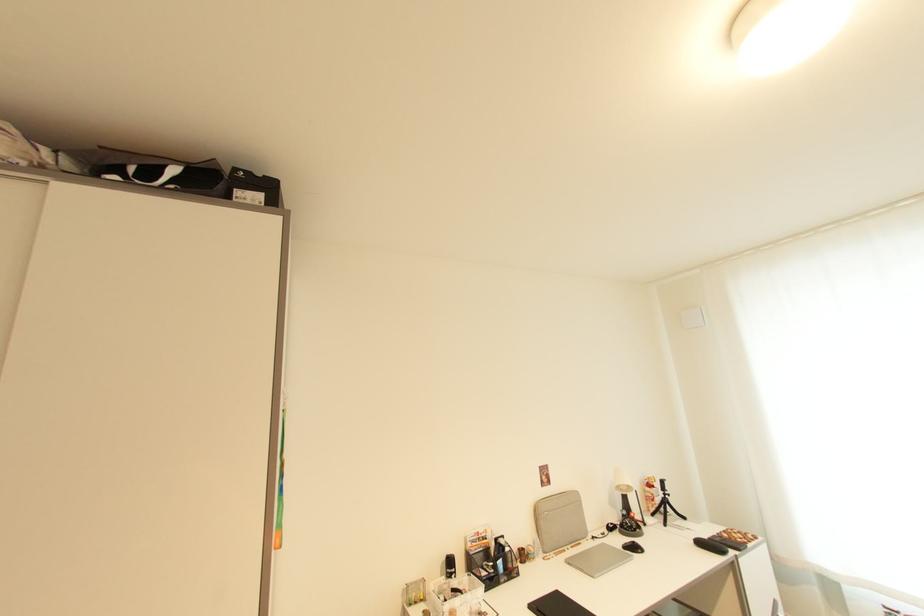
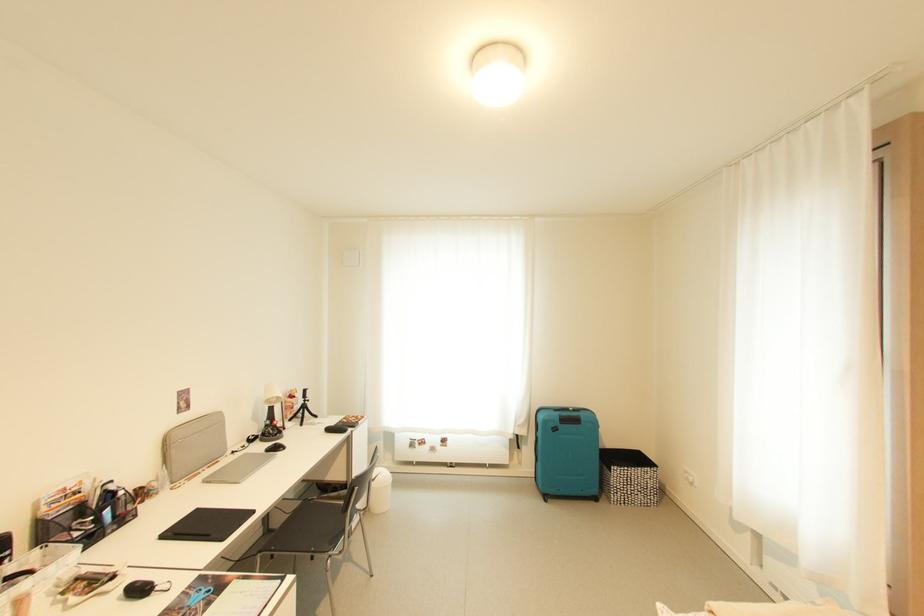
Where in the second image is the point corresponding to pixel 639 549 from the first image?

(282, 450)